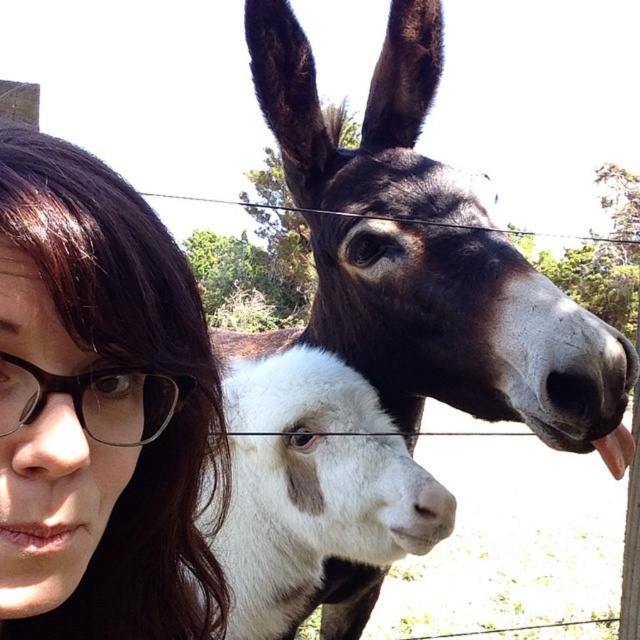
Question: Can you confirm if black glossy donkey at upper center is positioned above black plastic glasses at left?

Choices:
 (A) yes
 (B) no

Answer: (A)

Question: From the image, what is the correct spatial relationship of brown hair at left in relation to black plastic glasses at left?

Choices:
 (A) below
 (B) above

Answer: (A)

Question: Among these points, which one is farthest from the camera?

Choices:
 (A) (252, 592)
 (B) (168, 276)
 (C) (106, 422)
 (D) (570, 332)

Answer: (A)

Question: Which point is farther from the camera taking this photo?

Choices:
 (A) (44, 451)
 (B) (332, 170)
 (C) (308, 497)
 (D) (122, 387)

Answer: (B)

Question: Which object is farther from the camera taking this photo?

Choices:
 (A) black glossy donkey at upper center
 (B) brown hair at left
 (C) white woolen goat at center

Answer: (C)

Question: Is black glossy donkey at upper center behind black plastic glasses at left?

Choices:
 (A) yes
 (B) no

Answer: (A)